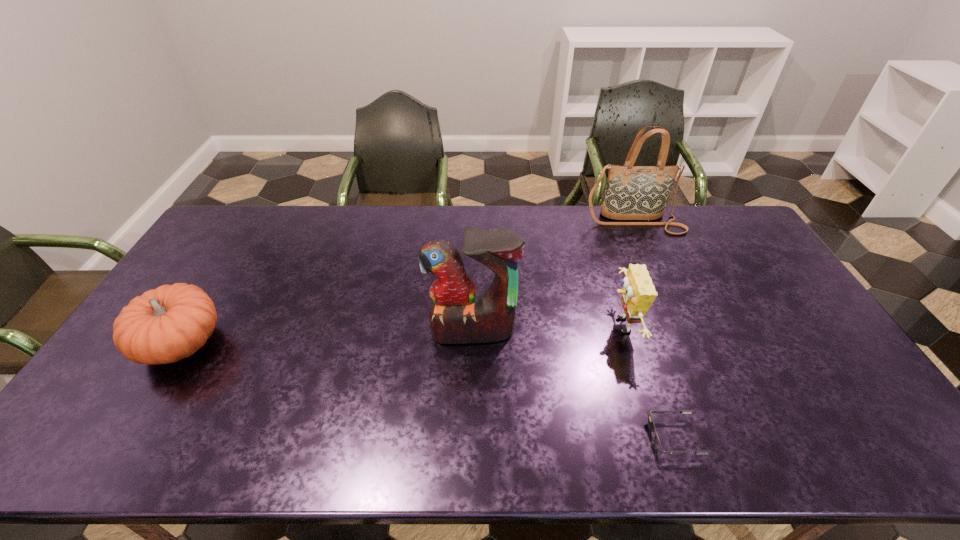
You are a GUI agent. You are given a task and a screenshot of the screen. Output one action in this format:
    pyautogui.click(x=<x>, y=<y>)
    Task: Click on the vacant region at the left edge of the desktop
    The width and height of the screenshot is (960, 540).
    Given the screenshot: What is the action you would take?
    pyautogui.click(x=126, y=394)

At what (x,y) coordinates should I click in order to perform the action: click on free space at the right edge of the desktop. Please return your answer as a coordinate pair (x, y). Image resolution: width=960 pixels, height=540 pixels. Looking at the image, I should click on (759, 253).

What are the coordinates of `free space that is in between the sponge and the parrot` in the screenshot? It's located at (547, 328).

You are a GUI agent. You are given a task and a screenshot of the screen. Output one action in this format:
    pyautogui.click(x=<x>, y=<y>)
    Task: Click on the vacant area between the second object from left to right and the pumpkin
    
    Given the screenshot: What is the action you would take?
    pyautogui.click(x=328, y=337)

Where is `free space between the shortest object and the fourth tallest object`? This screenshot has height=540, width=960. free space between the shortest object and the fourth tallest object is located at coordinates (429, 390).

Find the location of `free space between the shortest object and the fourth tallest object`. free space between the shortest object and the fourth tallest object is located at coordinates (429, 390).

At what (x,y) coordinates should I click in order to perform the action: click on empty space that is in between the handbag and the parrot. Please return your answer as a coordinate pair (x, y). The width and height of the screenshot is (960, 540). Looking at the image, I should click on (553, 276).

The width and height of the screenshot is (960, 540). What are the coordinates of `vacant region between the shortest object and the leftmost object` in the screenshot? It's located at (429, 390).

Identify the location of free spot between the fourth tallest object and the nearest object. (429, 390).

Image resolution: width=960 pixels, height=540 pixels. Identify the location of free point between the second object from left to right and the second shortest object. coord(328,337).